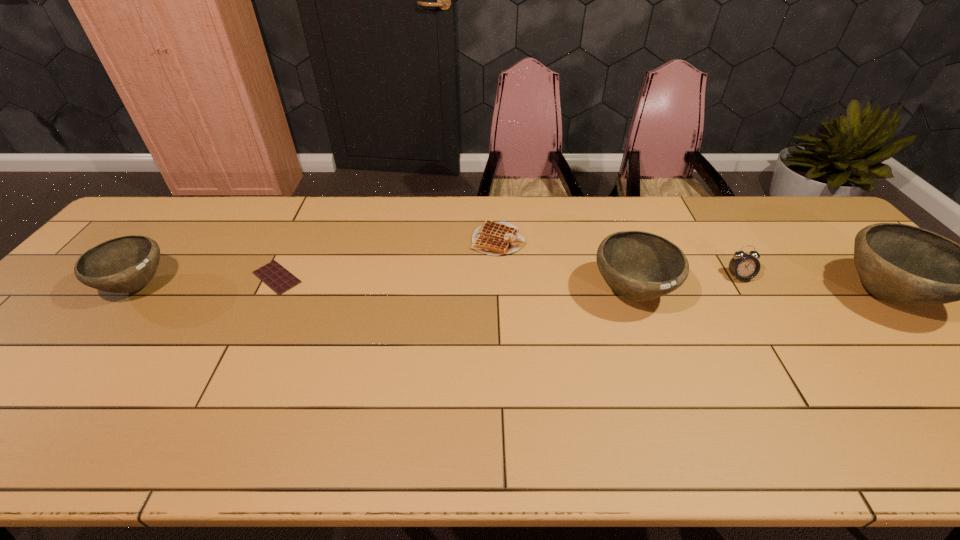
Image resolution: width=960 pixels, height=540 pixels. I want to click on spot to insert another bowl for uniform distribution, so click(x=382, y=289).